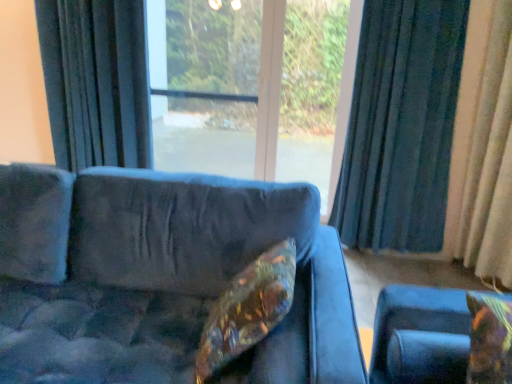
Question: From a real-world perspective, relative to shiny metallic pillow at center, which ranks as the second pillow in right-to-left order, is dark blue fabric curtain at left, which is counted as the 1th curtain, starting from the left, vertically above or below?

Choices:
 (A) above
 (B) below

Answer: (A)

Question: Considering the positions of dark blue fabric curtain at left, which is counted as the 1th curtain, starting from the left, and shiny metallic pillow at center, which ranks as the second pillow in right-to-left order, in the image, is dark blue fabric curtain at left, which is counted as the 1th curtain, starting from the left, bigger or smaller than shiny metallic pillow at center, which ranks as the second pillow in right-to-left order,?

Choices:
 (A) small
 (B) big

Answer: (B)

Question: Considering the real-world distances, which object is farthest from the velvet-like floral pillow at lower right, which is the 2th pillow from left to right?

Choices:
 (A) dark blue fabric curtain at right, which is the second curtain in right-to-left order
 (B) transparent glass screen door at center
 (C) velvet blue couch at center
 (D) shiny metallic pillow at center, which ranks as the second pillow in right-to-left order
 (E) beige fabric curtain at right, which is the first curtain from right to left

Answer: (B)

Question: Based on their relative distances, which object is farther from the beige fabric curtain at right, which is the first curtain from right to left?

Choices:
 (A) dark blue fabric curtain at right, the second curtain viewed from the left
 (B) velvet blue couch at center
 (C) transparent glass screen door at center
 (D) velvet-like floral pillow at lower right, which is the 2th pillow from left to right
 (E) dark blue fabric curtain at left, which is counted as the 1th curtain, starting from the left

Answer: (E)